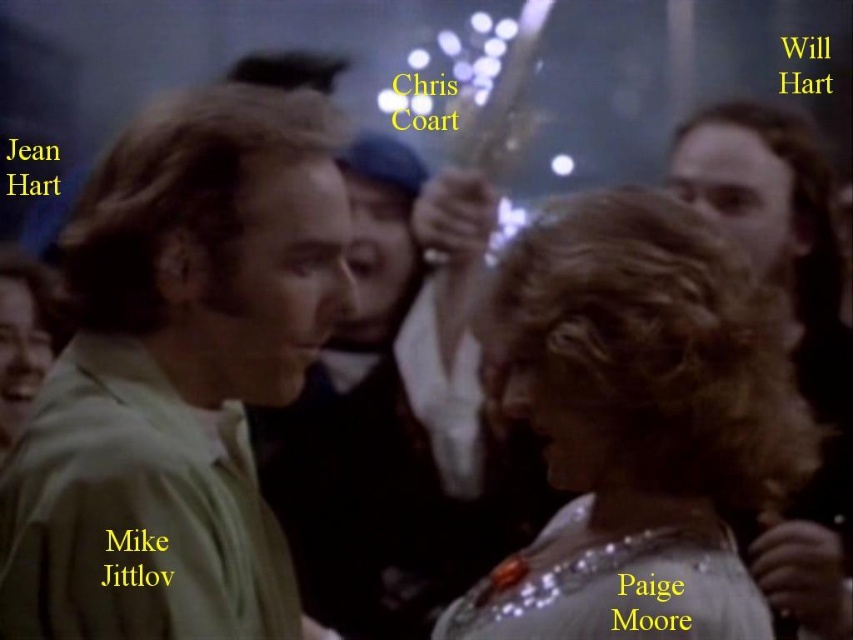
You are at a party and want to introduce yourself to the person wearing the satin silver dress at center. Which direction should you move relative to the smooth black shirt at center?

The satin silver dress at center is positioned on the right side of smooth black shirt at center, so you should move to the right of the smooth black shirt at center to reach the person wearing the satin silver dress at center.

You are a photographer at a party and want to capture a photo of the satin silver dress at center and the dark brown hair at right. Based on their positions, which object should you focus on first to ensure both are in frame?

The satin silver dress at center is located below dark brown hair at right, so you should focus on the dark brown hair at right first to ensure both are in frame.